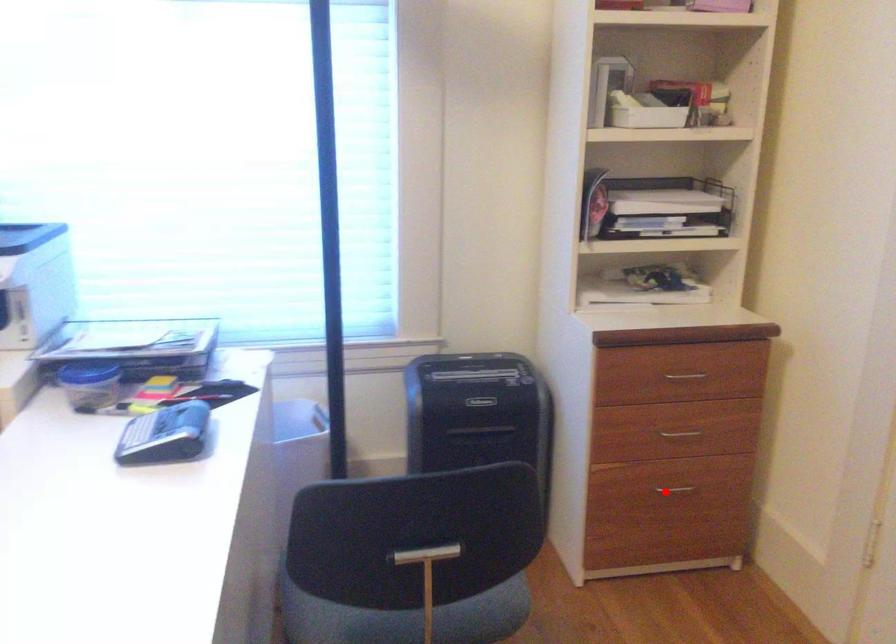
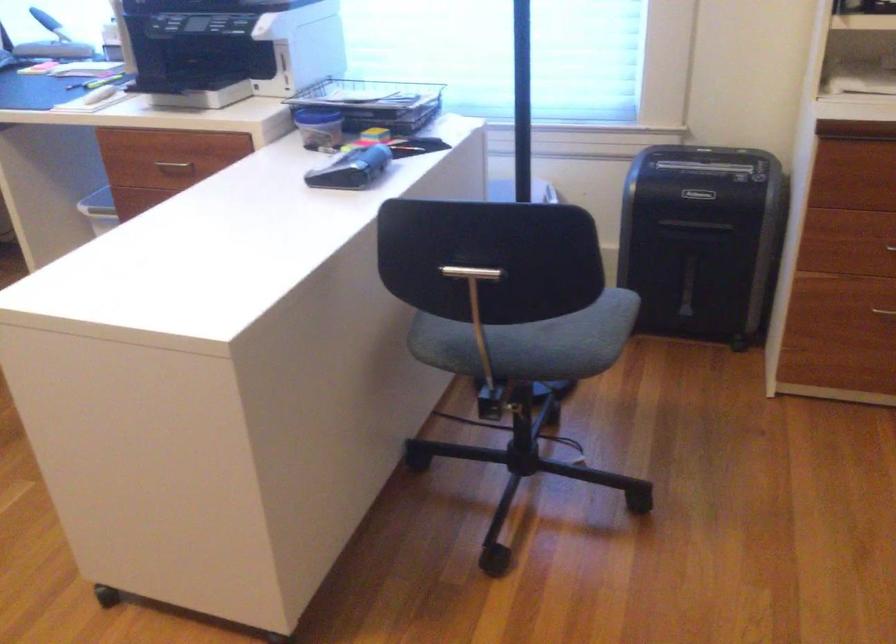
In the second image, find the point that corresponds to the highlighted location in the first image.

(883, 313)